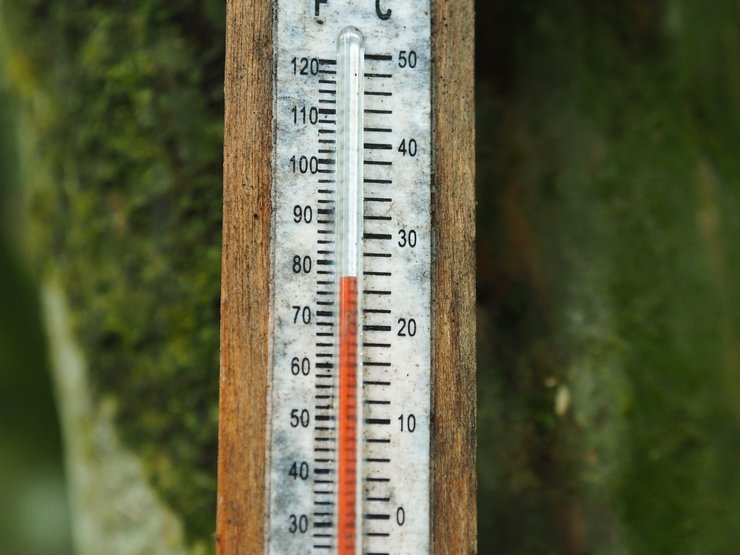
Where is `thermometer`? thermometer is located at coordinates [x=363, y=41].